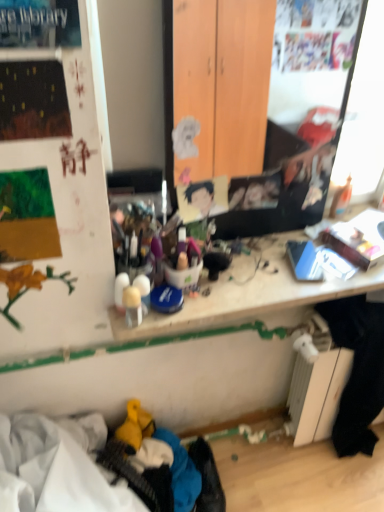
Question: From a real-world perspective, is black fabric at lower right physically above smooth cardboard portrait at center?

Choices:
 (A) yes
 (B) no

Answer: (B)

Question: Is black fabric at lower right directly adjacent to smooth cardboard portrait at center?

Choices:
 (A) yes
 (B) no

Answer: (B)

Question: Does black fabric at lower right have a smaller size compared to smooth cardboard portrait at center?

Choices:
 (A) no
 (B) yes

Answer: (A)

Question: Is black fabric at lower right oriented towards smooth cardboard portrait at center?

Choices:
 (A) no
 (B) yes

Answer: (A)

Question: From the image's perspective, is black fabric at lower right beneath smooth cardboard portrait at center?

Choices:
 (A) no
 (B) yes

Answer: (B)

Question: Considering their positions, is black fabric at lower right located in front of or behind wooden desk at center?

Choices:
 (A) front
 (B) behind

Answer: (B)

Question: In terms of width, does black fabric at lower right look wider or thinner when compared to wooden desk at center?

Choices:
 (A) wide
 (B) thin

Answer: (B)

Question: Would you say black fabric at lower right is to the left or to the right of wooden desk at center in the picture?

Choices:
 (A) right
 (B) left

Answer: (A)

Question: In terms of height, does black fabric at lower right look taller or shorter compared to wooden desk at center?

Choices:
 (A) short
 (B) tall

Answer: (B)

Question: Visually, is wooden desk at center positioned to the left or to the right of black fabric at lower right?

Choices:
 (A) right
 (B) left

Answer: (B)

Question: Is point (253, 321) closer or farther from the camera than point (340, 322)?

Choices:
 (A) closer
 (B) farther

Answer: (A)

Question: In the image, is wooden desk at center positioned in front of or behind black fabric at lower right?

Choices:
 (A) behind
 (B) front

Answer: (B)

Question: From the image's perspective, is wooden desk at center positioned above or below black fabric at lower right?

Choices:
 (A) above
 (B) below

Answer: (A)

Question: Based on their sizes in the image, would you say black fabric at lower right is bigger or smaller than smooth cardboard portrait at center?

Choices:
 (A) small
 (B) big

Answer: (B)

Question: Do you think black fabric at lower right is within smooth cardboard portrait at center, or outside of it?

Choices:
 (A) outside
 (B) inside

Answer: (A)